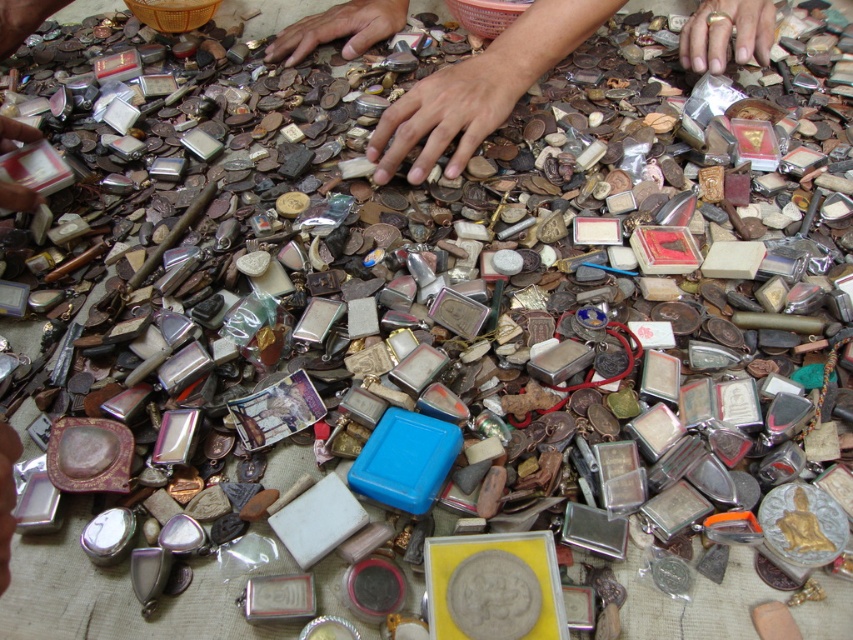
In the scene shown: You are an archaeologist examining the artifacts on the table. You notice the gold metallic ring at upper center and the brown matte hand at upper center. Which object is positioned closer to you?

The gold metallic ring at upper center is closer to the viewer than the brown matte hand at upper center.

In the scene shown: You are an archaeologist examining the artifacts on the table. You notice a point marked at coordinates (480, 88). Based on the scene description, where is this point located?

The point at coordinates (480, 88) is on smooth brown hands at center, so it is located on the hands holding the artifacts.

You are an archaeologist examining the artifacts on the table. You need to determine which of the two objects, the brown matte hand at upper center or the matte black coin at upper left, is smaller in height. Which one is it?

The brown matte hand at upper center is shorter than the matte black coin at upper left, so the brown matte hand at upper center is smaller in height.